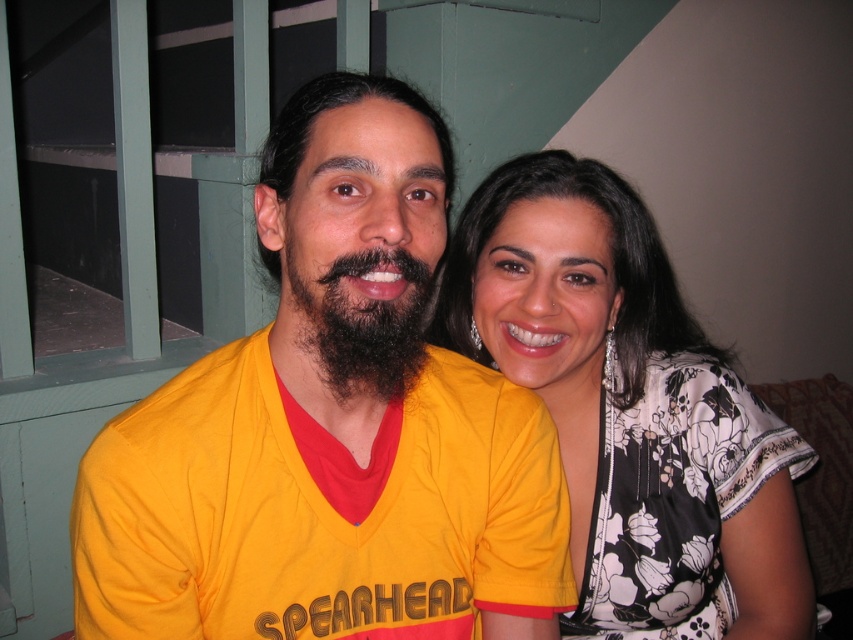
You are a photographer standing at the camera position. You want to adjust your focus to capture the white floral blouse at upper right clearly. What is the minimum distance you need to set your focus to in inches?

The white floral blouse at upper right is 31.04 inches away from the camera, so you need to set the focus distance to at least 31.04 inches to capture it clearly.

You are a photographer adjusting the camera focus. The yellow fabric shirt at center and the dark brown curly beard at center are in the frame. Which object should you focus on first if you want to ensure the taller one is sharp?

The yellow fabric shirt at center is taller than the dark brown curly beard at center, so focus on the yellow fabric shirt at center first to ensure it is sharp.

You are standing in the room where the two people are sitting. You want to place a small decorative item exactly at the point marked by coordinates point (331, 428). What object will the item be placed on?

→ The small decorative item will be placed on the yellow fabric shirt at center located at point (331, 428).